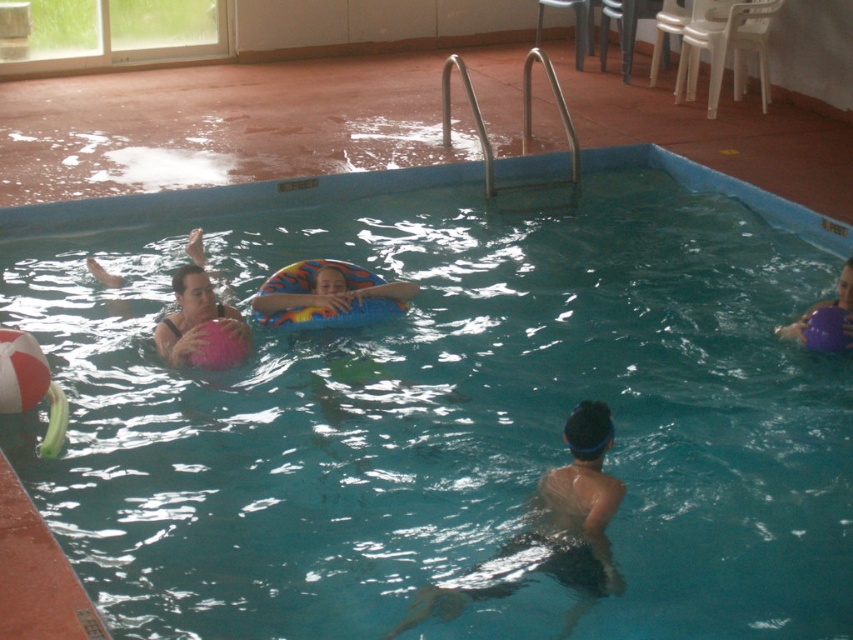
Question: Estimate the real-world distances between objects in this image. Which object is farther from the black rubber swim cap at center?

Choices:
 (A) pink matte ball at center
 (B) multicolored rubber ring at center

Answer: (A)

Question: Estimate the real-world distances between objects in this image. Which object is closer to the multicolored rubber ring at center?

Choices:
 (A) purple rubber ball at right
 (B) pink matte ball at center
 (C) black rubber swim cap at center

Answer: (B)

Question: Does multicolored rubber ring at center appear on the left side of pink matte ball at center?

Choices:
 (A) yes
 (B) no

Answer: (B)

Question: Is pink matte ball at center wider than purple rubber ball at right?

Choices:
 (A) no
 (B) yes

Answer: (B)

Question: Among these objects, which one is nearest to the camera?

Choices:
 (A) pink matte ball at center
 (B) multicolored rubber ring at center
 (C) purple rubber ball at right

Answer: (A)

Question: Where is black rubber swim cap at center located in relation to multicolored rubber ring at center in the image?

Choices:
 (A) below
 (B) above

Answer: (A)